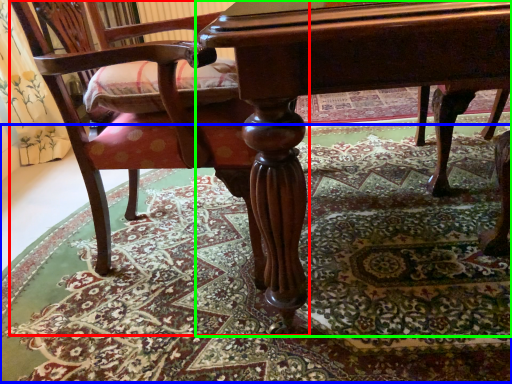
Question: Based on their relative distances, which object is farther from chair (highlighted by a red box)? Choose from mat (highlighted by a blue box) and table (highlighted by a green box).

Choices:
 (A) mat
 (B) table

Answer: (A)